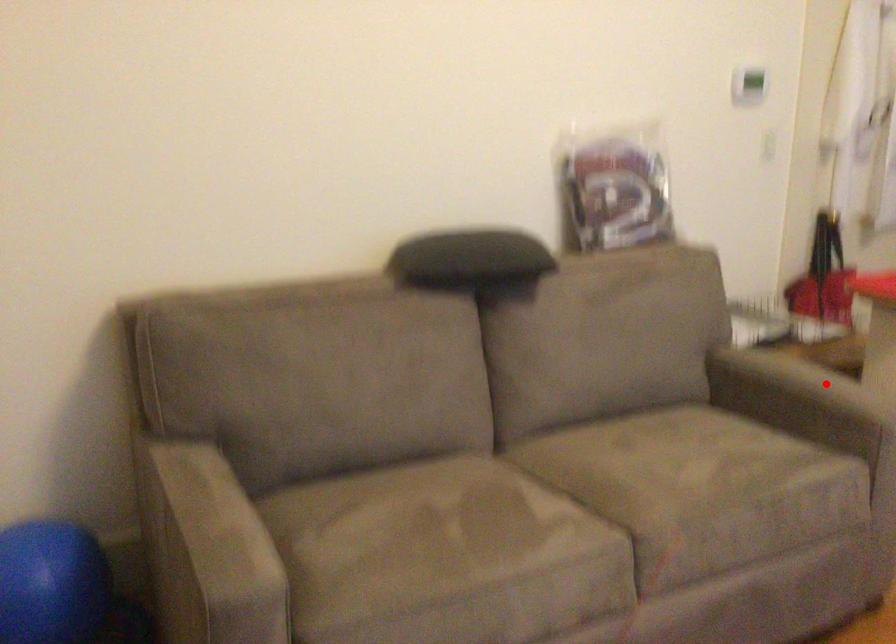
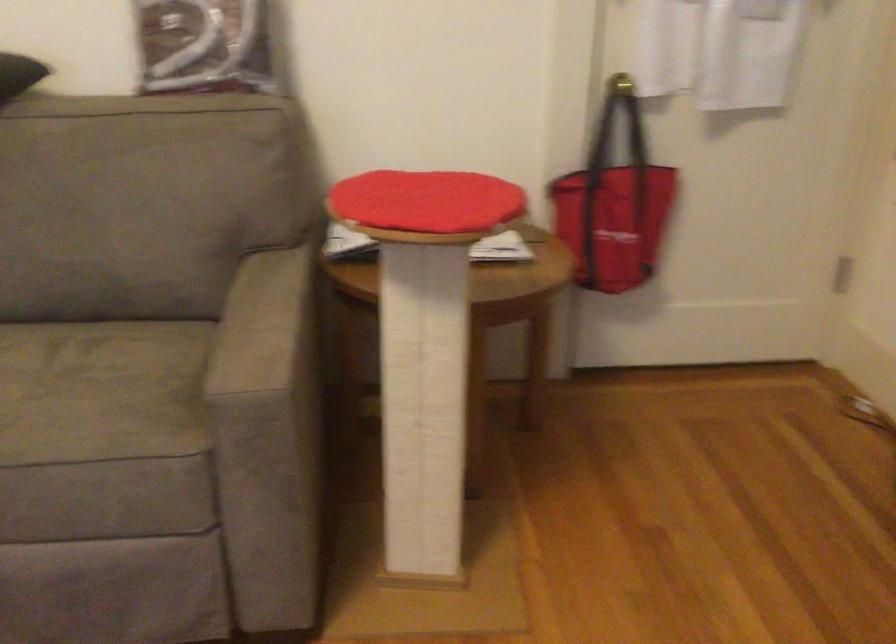
Question: I am providing you with two images of the same scene from different viewpoints. Image1 has a red point marked. In image2, the corresponding 3D location appears at what relative position? Reply with the corresponding letter.

Choices:
 (A) Closer
 (B) Farther

Answer: (A)